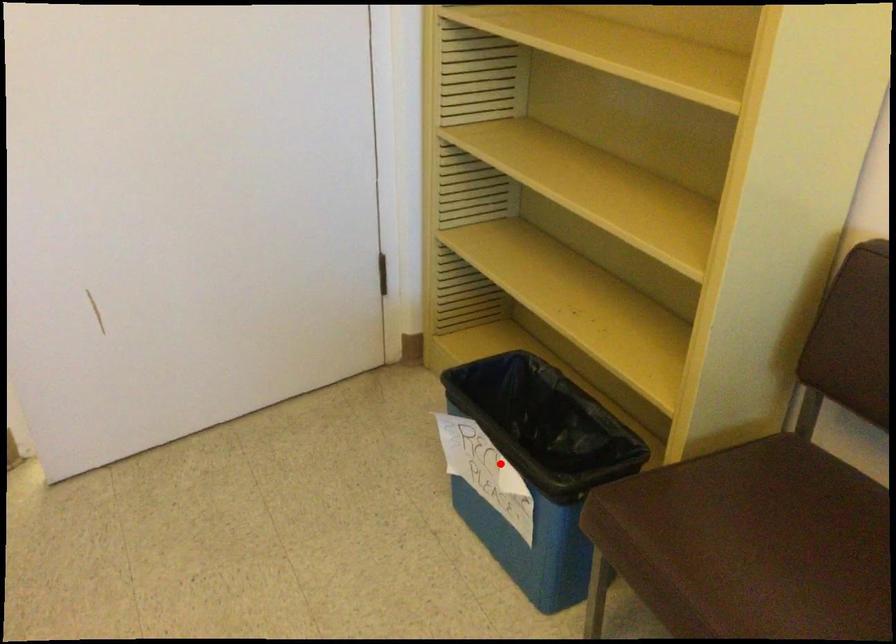
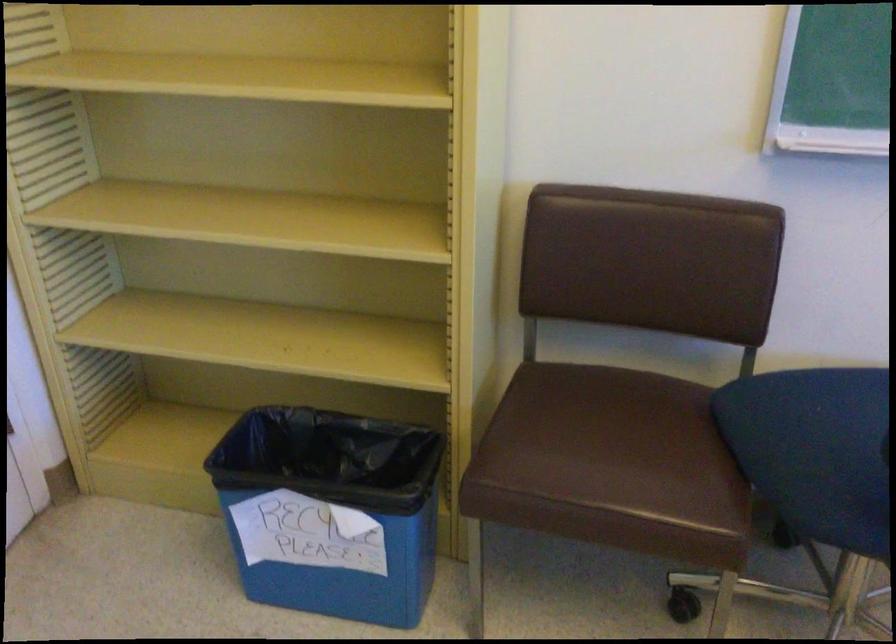
In the second image, find the point that corresponds to the highlighted location in the first image.

(331, 511)